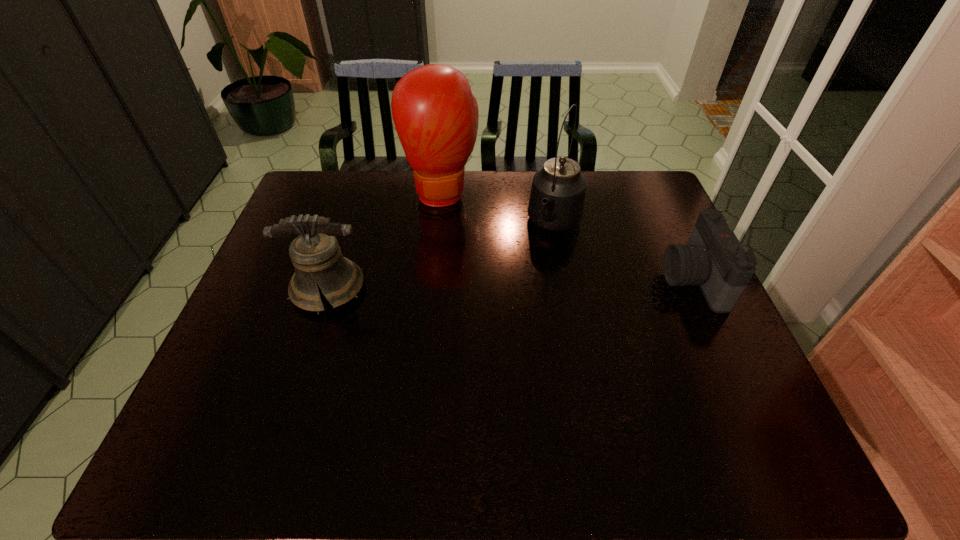
The image size is (960, 540). Find the location of `free point between the boxing glove and the second object from right to left`. free point between the boxing glove and the second object from right to left is located at coordinates (499, 209).

The image size is (960, 540). Identify the location of vacant area between the camera and the bell. (511, 284).

You are a GUI agent. You are given a task and a screenshot of the screen. Output one action in this format:
    pyautogui.click(x=<x>, y=<y>)
    Task: Click on the vacant area that lies between the third object from left to right and the shortest object
    
    Given the screenshot: What is the action you would take?
    pyautogui.click(x=624, y=252)

Where is `free space between the third object from left to right and the third object from right to left`? Image resolution: width=960 pixels, height=540 pixels. free space between the third object from left to right and the third object from right to left is located at coordinates (499, 209).

Identify the location of free space between the kettle and the leftmost object. The height and width of the screenshot is (540, 960). coord(442,256).

Locate an element on the screen. The height and width of the screenshot is (540, 960). free point between the second object from left to right and the shortest object is located at coordinates (567, 236).

Image resolution: width=960 pixels, height=540 pixels. What are the coordinates of `object that is the second closest to the rightmost object` in the screenshot? It's located at (435, 114).

Locate which object ranks second in proximity to the boxing glove. Please provide its 2D coordinates. Your answer should be formatted as a tuple, i.e. [(x, y)], where the tuple contains the x and y coordinates of a point satisfying the conditions above.

[(316, 256)]